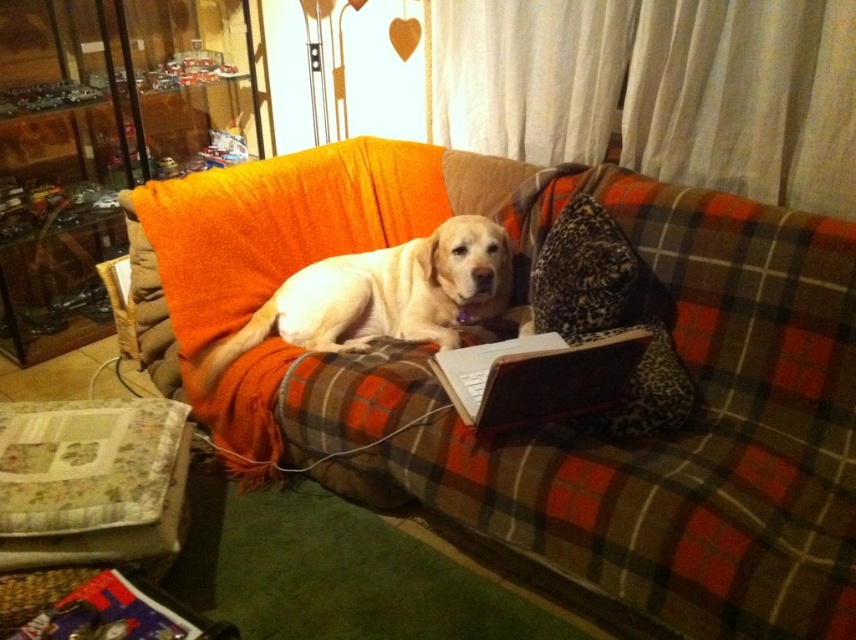
Question: Which object is the farthest from the metallic silver book at lower left?

Choices:
 (A) silver metallic laptop at center
 (B) light yellow fur at center

Answer: (B)

Question: Where is light yellow fur at center located in relation to silver metallic laptop at center in the image?

Choices:
 (A) above
 (B) below

Answer: (A)

Question: Which point appears closest to the camera in this image?

Choices:
 (A) (666, 349)
 (B) (507, 340)
 (C) (339, 308)
 (D) (183, 621)

Answer: (D)

Question: Is leopard print pillow at center to the right of silver metallic laptop at center from the viewer's perspective?

Choices:
 (A) no
 (B) yes

Answer: (B)

Question: Which point appears farthest from the camera in this image?

Choices:
 (A) (56, 634)
 (B) (542, 360)
 (C) (646, 388)
 (D) (349, 339)

Answer: (D)

Question: Considering the relative positions of silver metallic laptop at center and metallic silver book at lower left in the image provided, where is silver metallic laptop at center located with respect to metallic silver book at lower left?

Choices:
 (A) left
 (B) right

Answer: (B)